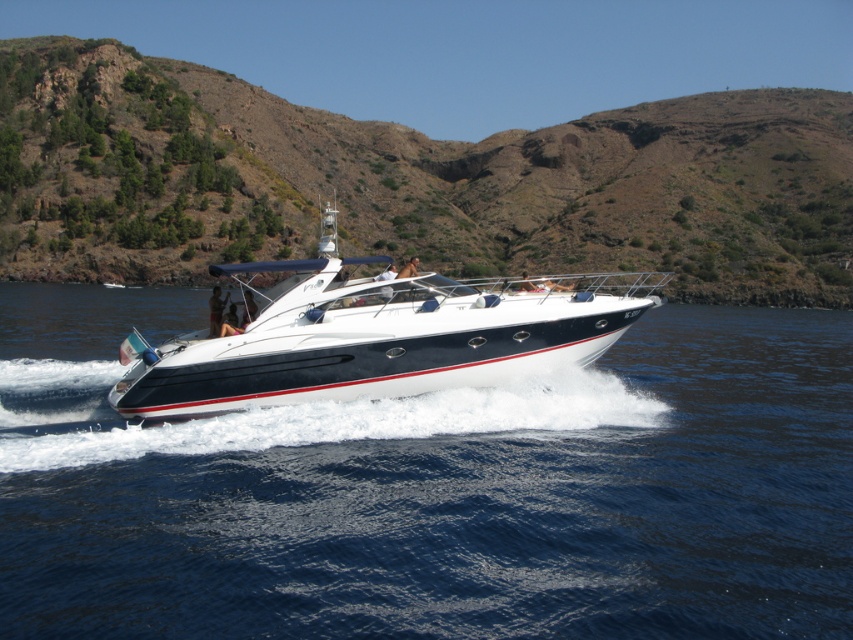
Question: Which of the following is the closest to the observer?

Choices:
 (A) (515, 502)
 (B) (375, 228)

Answer: (A)

Question: Does brown/dry grass hillside at upper center have a smaller size compared to white glossy boat at center?

Choices:
 (A) no
 (B) yes

Answer: (A)

Question: Does blue liquid water at center appear over brown/dry grass hillside at upper center?

Choices:
 (A) yes
 (B) no

Answer: (B)

Question: Where is brown/dry grass hillside at upper center located in relation to white glossy boat at center in the image?

Choices:
 (A) above
 (B) below

Answer: (A)

Question: Among these points, which one is farthest from the camera?

Choices:
 (A) (677, 195)
 (B) (3, 534)
 (C) (613, 314)

Answer: (A)

Question: Among these points, which one is nearest to the camera?

Choices:
 (A) (415, 512)
 (B) (833, 237)
 (C) (294, 394)

Answer: (A)